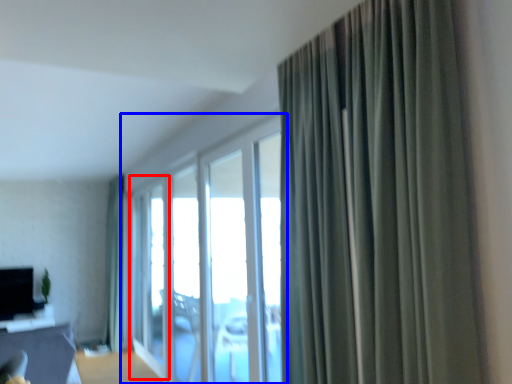
Question: Which point is further to the camera, screen door (highlighted by a red box) or window (highlighted by a blue box)?

Choices:
 (A) screen door
 (B) window

Answer: (A)